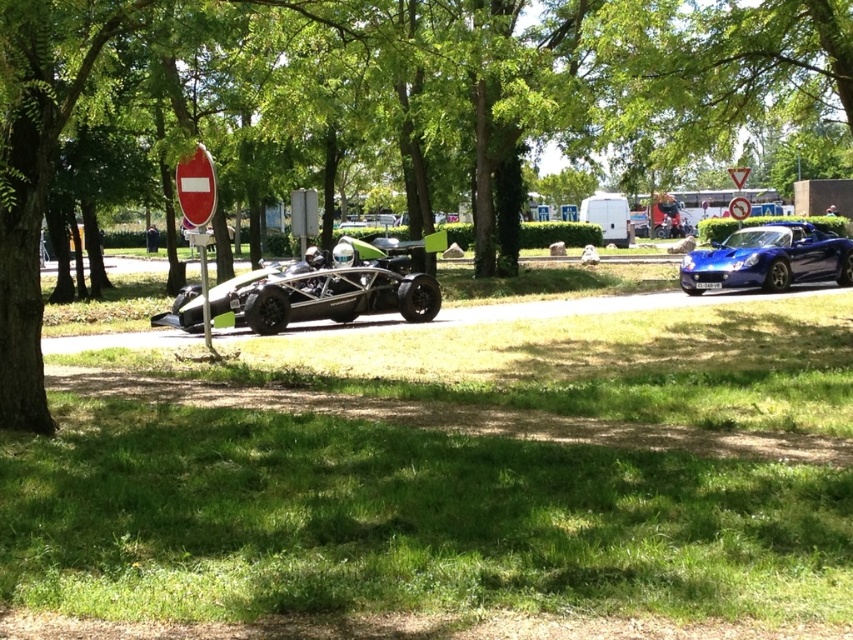
You are planning to set up a picnic blanket in the green grass at lower center. Considering the space available, will the shiny blue car at center be entirely visible from your picnic spot?

The green grass at lower center has a larger width than the shiny blue car at center, so the entire shiny blue car at center will be visible from the picnic spot.

You are standing at the edge of the green grass at lower center and want to walk towards the glossy blue sports car at right. Which direction should you move to reach it?

You should move to the right because the glossy blue sports car at right is positioned to the right of the green grass at lower center.

You are a delivery robot with a 2.5 meter wide package. You need to move from the green grass at lower center to the glossy blue sports car at right. Is there enough space between them for your package?

The distance between the green grass at lower center and the glossy blue sports car at right is 12.79 meters. Since the package is only 2.5 meters wide, there is sufficient space for the delivery robot to navigate between them.